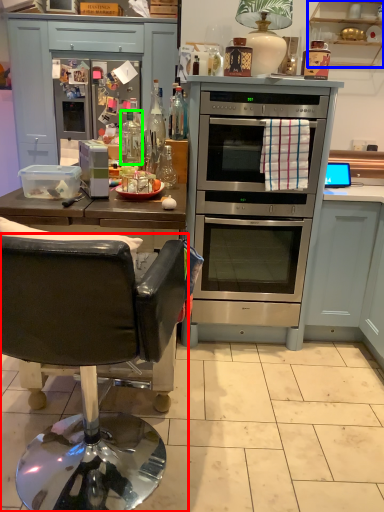
Question: Which object is positioned farthest from chair (highlighted by a red box)? Select from cabinetry (highlighted by a blue box) and bottle (highlighted by a green box).

Choices:
 (A) cabinetry
 (B) bottle

Answer: (A)